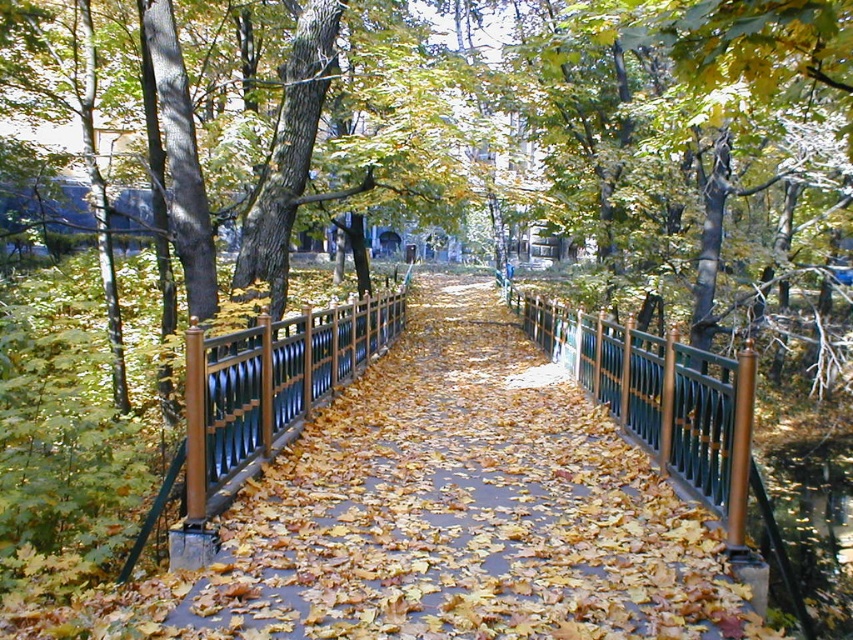
Measure the distance between point (526, 365) and camera.

The distance of point (526, 365) from camera is 12.44 meters.

Does metallic green fence at center have a greater height compared to green metal fence at center?

In fact, metallic green fence at center may be shorter than green metal fence at center.

Which is behind, point (483, 371) or point (202, 490)?

Positioned behind is point (483, 371).

This screenshot has height=640, width=853. I want to click on metallic green fence at center, so click(x=471, y=348).